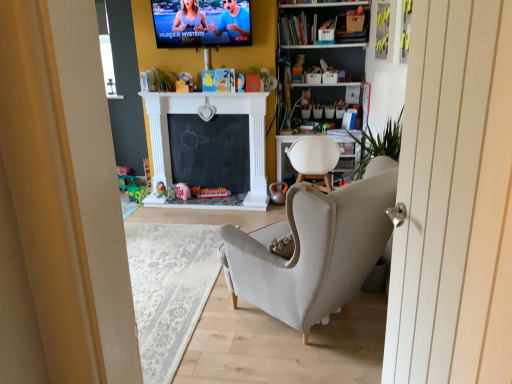
Question: Is translucent plastic toy at center, the 4th toy positioned from the right, at the right side of metallic silver toy at center, placed as the fifth toy when sorted from left to right?

Choices:
 (A) no
 (B) yes

Answer: (A)

Question: Considering the relative positions of translucent plastic toy at center, the 4th toy positioned from the right, and metallic silver toy at center, which is counted as the 1th toy, starting from the right, in the image provided, is translucent plastic toy at center, the 4th toy positioned from the right, to the left of metallic silver toy at center, which is counted as the 1th toy, starting from the right, from the viewer's perspective?

Choices:
 (A) yes
 (B) no

Answer: (A)

Question: Is metallic silver toy at center, which is counted as the 1th toy, starting from the right, at the back of translucent plastic toy at center, which is counted as the 2th toy, starting from the left?

Choices:
 (A) yes
 (B) no

Answer: (B)

Question: Is translucent plastic toy at center, the 4th toy positioned from the right, next to metallic silver toy at center, placed as the fifth toy when sorted from left to right, and touching it?

Choices:
 (A) yes
 (B) no

Answer: (B)

Question: Does translucent plastic toy at center, the 4th toy positioned from the right, contain metallic silver toy at center, which is counted as the 1th toy, starting from the right?

Choices:
 (A) yes
 (B) no

Answer: (B)

Question: Considering the relative sizes of translucent plastic toy at center, which is counted as the 2th toy, starting from the left, and metallic silver toy at center, which is counted as the 1th toy, starting from the right, in the image provided, is translucent plastic toy at center, which is counted as the 2th toy, starting from the left, thinner than metallic silver toy at center, which is counted as the 1th toy, starting from the right,?

Choices:
 (A) yes
 (B) no

Answer: (B)

Question: From a real-world perspective, is metallic silver toy at center, which is counted as the 1th toy, starting from the right, on top of green plastic toy at lower left, marked as the 1th toy in a left-to-right arrangement?

Choices:
 (A) no
 (B) yes

Answer: (B)

Question: Considering the relative positions of metallic silver toy at center, placed as the fifth toy when sorted from left to right, and green plastic toy at lower left, which is counted as the 5th toy, starting from the right, in the image provided, is metallic silver toy at center, placed as the fifth toy when sorted from left to right, behind green plastic toy at lower left, which is counted as the 5th toy, starting from the right,?

Choices:
 (A) no
 (B) yes

Answer: (A)

Question: Is green plastic toy at lower left, which is counted as the 5th toy, starting from the right, a part of metallic silver toy at center, placed as the fifth toy when sorted from left to right?

Choices:
 (A) yes
 (B) no

Answer: (B)

Question: Is metallic silver toy at center, which is counted as the 1th toy, starting from the right, looking in the opposite direction of green plastic toy at lower left, which is counted as the 5th toy, starting from the right?

Choices:
 (A) yes
 (B) no

Answer: (B)

Question: Is metallic silver toy at center, placed as the fifth toy when sorted from left to right, shorter than green plastic toy at lower left, which is counted as the 5th toy, starting from the right?

Choices:
 (A) yes
 (B) no

Answer: (B)

Question: From the image's perspective, does metallic silver toy at center, placed as the fifth toy when sorted from left to right, appear higher than green plastic toy at lower left, which is counted as the 5th toy, starting from the right?

Choices:
 (A) no
 (B) yes

Answer: (B)

Question: Can you confirm if matte plastic tv at upper center is wider than pink fabric toy at center, the 3th toy from the left?

Choices:
 (A) no
 (B) yes

Answer: (B)